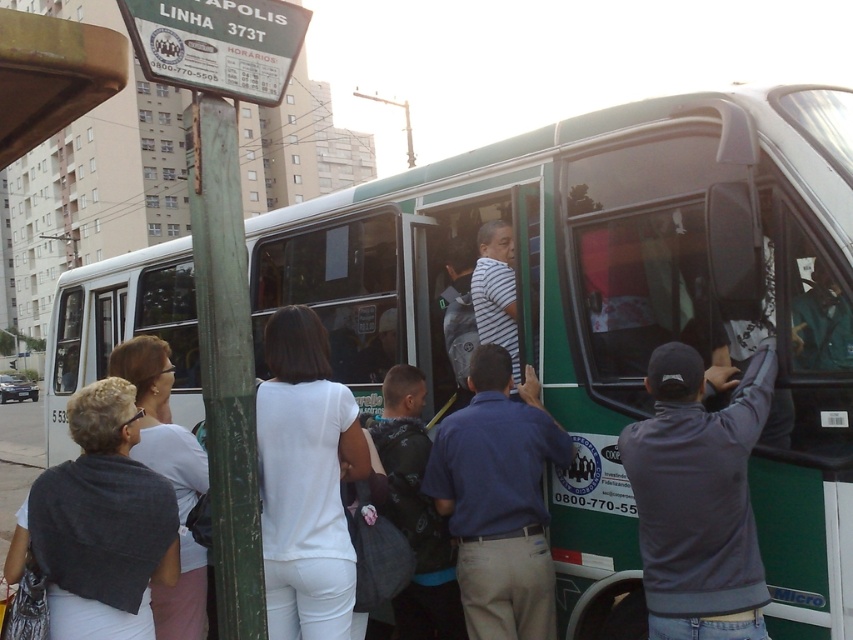
You are standing at the bus stop and want to know which of the two points, point (280, 513) or point (187, 557), is closer to you. Can you determine this based on the image?

Point (280, 513) is closer to the camera than point (187, 557), so it is closer to you.

You are a passenger waiting to board the LINHA 373T bus. You notice two people ahead of you in the boarding queue. One is wearing a blue shirt at center and the other a white fabric shirt at left. Which shirt is closer to the bus entrance?

The blue shirt at center is closer to the bus entrance because it is positioned below the white fabric shirt at left, indicating it is further forward in the boarding queue.